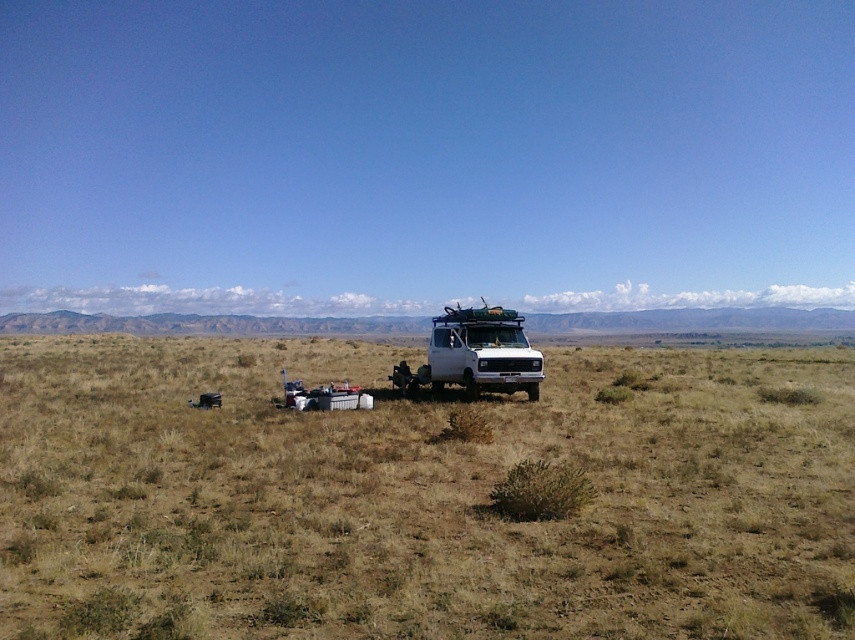
Who is more distant from viewer, (54, 470) or (499, 385)?

The point (499, 385) is more distant.

Looking at this image, how much distance is there between brown dry grass at center and white matte van at center?

brown dry grass at center is 9.96 meters away from white matte van at center.

Between point (316, 472) and point (513, 376), which one is positioned in front?

Point (316, 472)

The image size is (855, 640). In order to click on brown dry grass at center in this screenshot , I will do `click(419, 496)`.